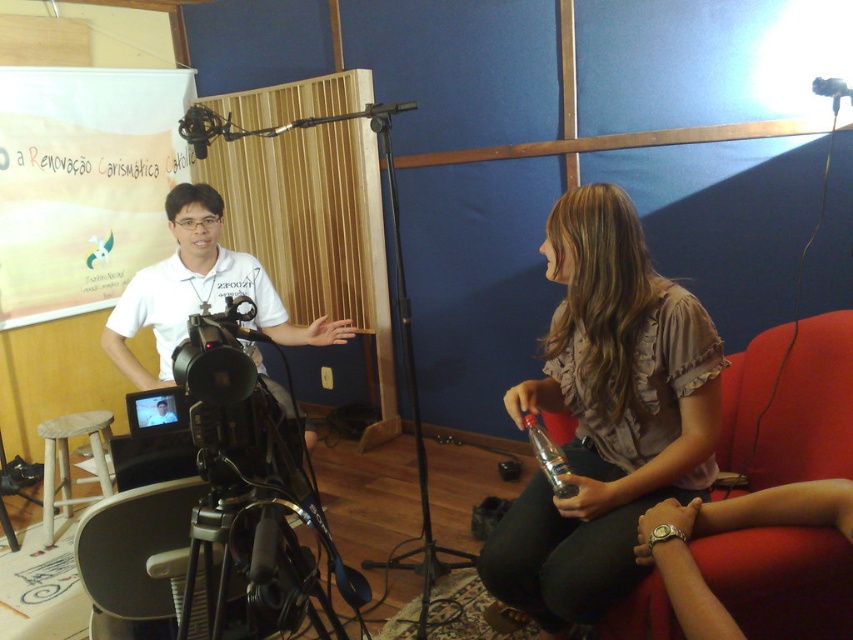
Question: Is red fabric armchair at right further to the viewer compared to matte white shirt at center?

Choices:
 (A) yes
 (B) no

Answer: (A)

Question: Which object is closer to the camera taking this photo?

Choices:
 (A) matte white shirt at center
 (B) black metal tripod at center
 (C) clear plastic microphone at lower center
 (D) light brown wooden stool at lower left

Answer: (A)

Question: Is black metal tripod at center wider than matte white shirt at center?

Choices:
 (A) no
 (B) yes

Answer: (B)

Question: Which of the following is the closest to the observer?

Choices:
 (A) black metal tripod at center
 (B) matte brown blouse at right

Answer: (B)

Question: Does red fabric armchair at right lie in front of light brown wooden stool at lower left?

Choices:
 (A) yes
 (B) no

Answer: (A)

Question: Which object is closer to the camera taking this photo?

Choices:
 (A) light brown wooden stool at lower left
 (B) clear plastic microphone at lower center
 (C) matte white shirt at center

Answer: (C)